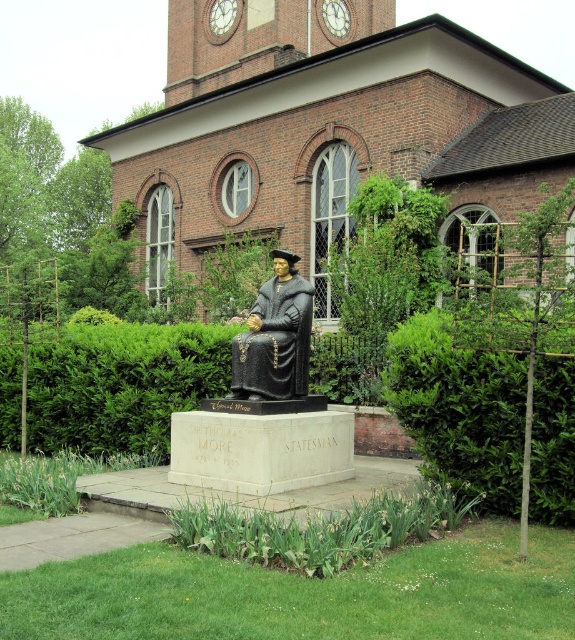
Does point (446, 426) come behind point (306, 305)?

No, it is not.

Is green leafy hedge at lower right bigger than bronze statue at center?

A: Yes, green leafy hedge at lower right is bigger than bronze statue at center.

What do you see at coordinates (460, 410) in the screenshot? I see `green leafy hedge at lower right` at bounding box center [460, 410].

Locate an element on the screen. green leafy hedge at lower right is located at coordinates (460, 410).

Is brown brick church at center bigger than green leafy hedge at lower right?

Indeed, brown brick church at center has a larger size compared to green leafy hedge at lower right.

Can you confirm if brown brick church at center is wider than green leafy hedge at lower right?

Yes, brown brick church at center is wider than green leafy hedge at lower right.

Where is `brown brick church at center`? brown brick church at center is located at coordinates (327, 125).

Based on the photo, does brown brick church at center lie in front of bronze statue at center?

That is False.

Can you confirm if brown brick church at center is wider than bronze statue at center?

Correct, the width of brown brick church at center exceeds that of bronze statue at center.

The width and height of the screenshot is (575, 640). I want to click on brown brick church at center, so click(x=327, y=125).